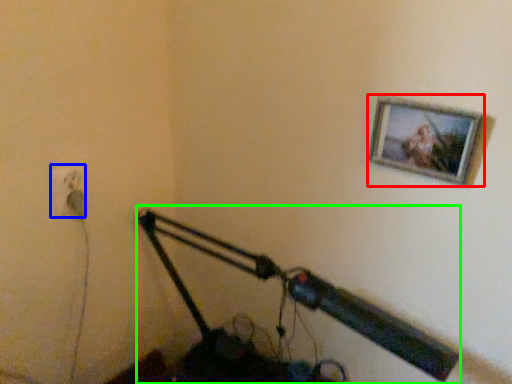
Question: Which object is positioned closest to picture frame (highlighted by a red box)? Select from electric outlet (highlighted by a blue box) and lamp (highlighted by a green box).

Choices:
 (A) electric outlet
 (B) lamp

Answer: (B)